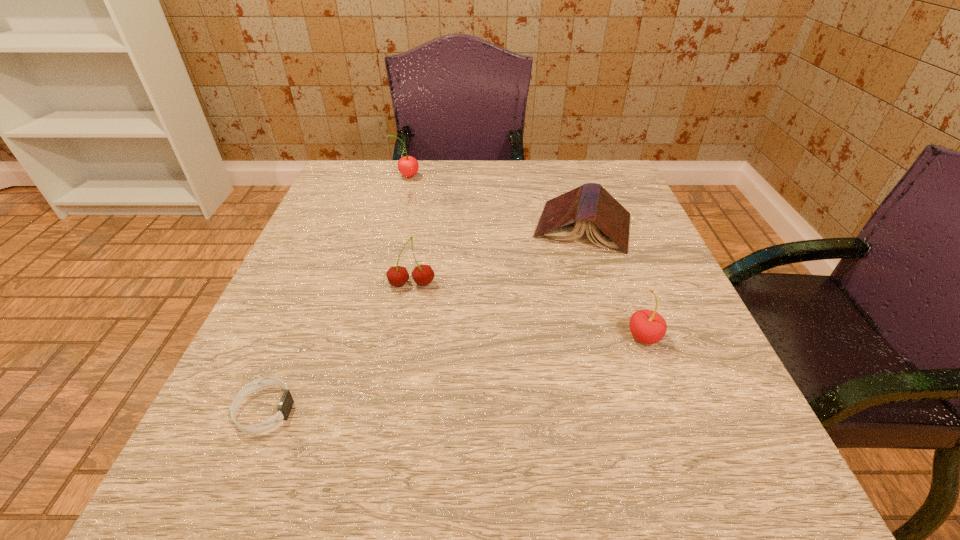
At what (x,y) coordinates should I click in order to perform the action: click on empty space that is in between the book and the nearest object. Please return your answer as a coordinate pair (x, y). Looking at the image, I should click on (424, 319).

At what (x,y) coordinates should I click in order to perform the action: click on vacant point located between the wristband and the farthest object. Please return your answer as a coordinate pair (x, y). Image resolution: width=960 pixels, height=540 pixels. Looking at the image, I should click on (336, 293).

This screenshot has height=540, width=960. Find the location of `free spot between the second nearest object and the third nearest object`. free spot between the second nearest object and the third nearest object is located at coordinates (528, 310).

Where is `empty space that is in between the farthest cherry and the third nearest object`? empty space that is in between the farthest cherry and the third nearest object is located at coordinates (409, 231).

Identify the location of unoccupied position between the nearest object and the second shortest object. (424, 319).

Identify the location of unoccupied area between the second nearest object and the farthest object. This screenshot has width=960, height=540. (525, 256).

Choose which object is the nearest neighbor to the book. Please provide its 2D coordinates. Your answer should be formatted as a tuple, i.e. [(x, y)], where the tuple contains the x and y coordinates of a point satisfying the conditions above.

[(647, 326)]

At what (x,y) coordinates should I click in order to perform the action: click on object that is the closest to the rightmost cherry. Please return your answer as a coordinate pair (x, y). This screenshot has height=540, width=960. Looking at the image, I should click on 564,218.

The image size is (960, 540). I want to click on the third closest cherry to the fourth nearest object, so click(x=408, y=166).

This screenshot has width=960, height=540. I want to click on cherry that is the closest to the second shortest object, so click(647, 326).